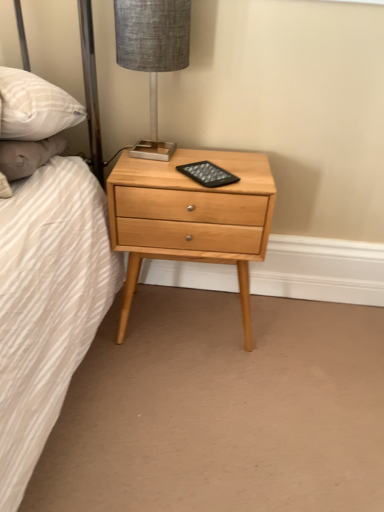
At what (x,y) coordinates should I click in order to perform the action: click on free spot in front of textured gray fabric lampshade at upper center. Please return your answer as a coordinate pair (x, y). Looking at the image, I should click on (144, 175).